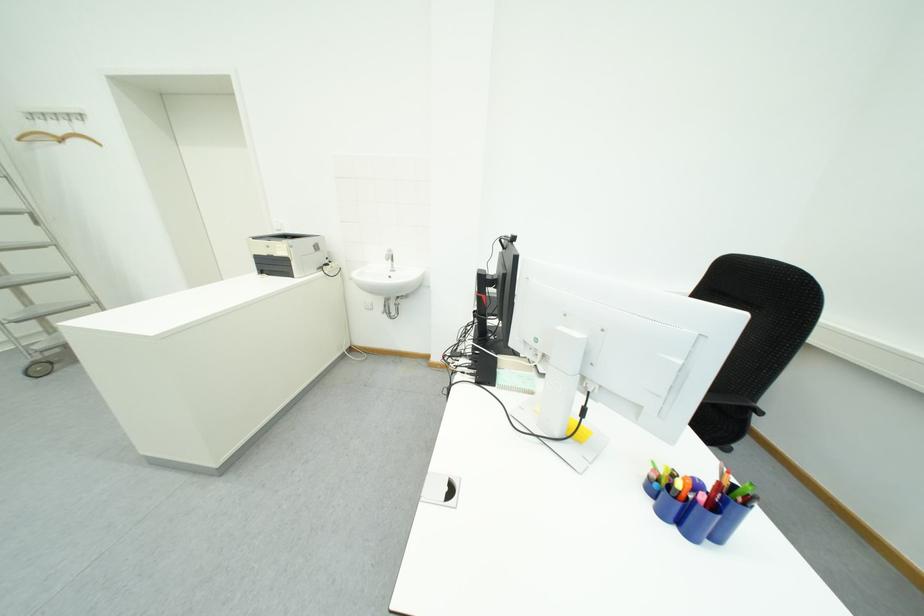
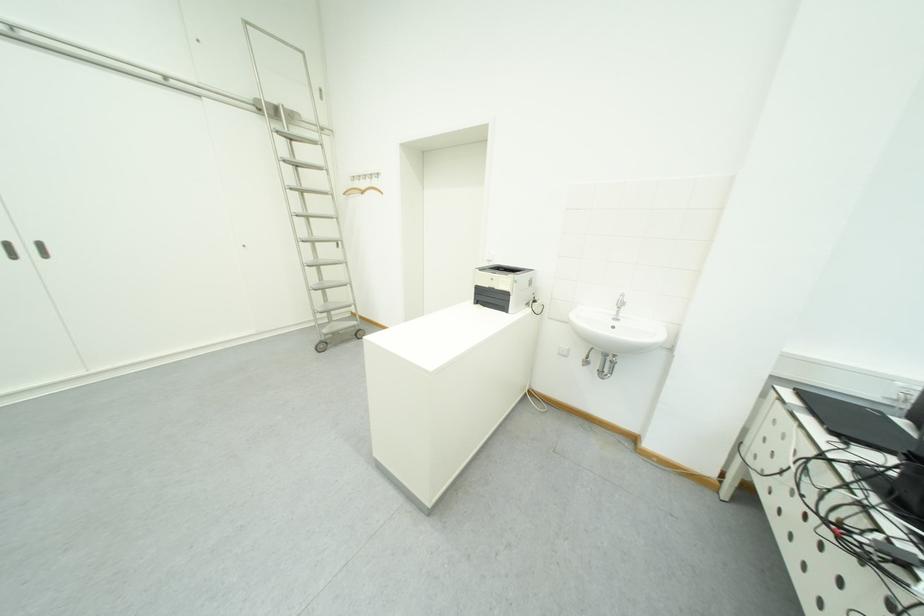
Question: The images are taken continuously from a first-person perspective. In which direction are you moving?

Choices:
 (A) Left
 (B) Right
 (C) Forward
 (D) Backward

Answer: (A)